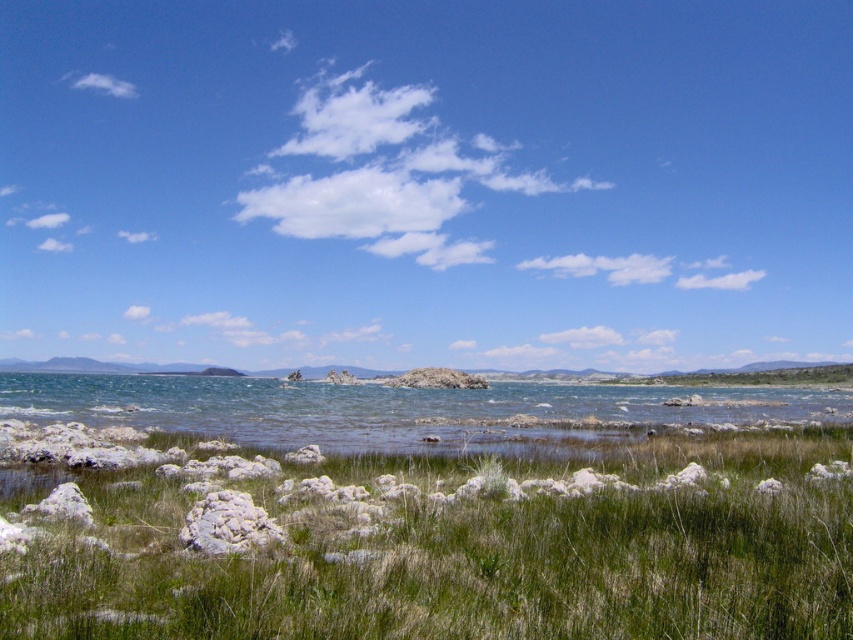
Question: Which object appears closest to the camera in this image?

Choices:
 (A) white fluffy cloud at upper left
 (B) white rock formation at center
 (C) white crusty rock at lower center

Answer: (C)

Question: Is clear water at center above white crusty rock at lower center?

Choices:
 (A) no
 (B) yes

Answer: (A)

Question: Observing the image, what is the correct spatial positioning of white rock formation at center in reference to clear water at center?

Choices:
 (A) right
 (B) left

Answer: (A)

Question: Which point is farther to the camera?

Choices:
 (A) clear water at center
 (B) white fluffy cloud at upper left
 (C) green grassy at lower center
 (D) white rock formation at center

Answer: (B)

Question: Which of the following is the closest to the observer?

Choices:
 (A) white crusty rock at lower center
 (B) white rock formation at center
 (C) clear water at center

Answer: (A)

Question: Is white rock formation at center in front of white fluffy cloud at upper left?

Choices:
 (A) no
 (B) yes

Answer: (B)